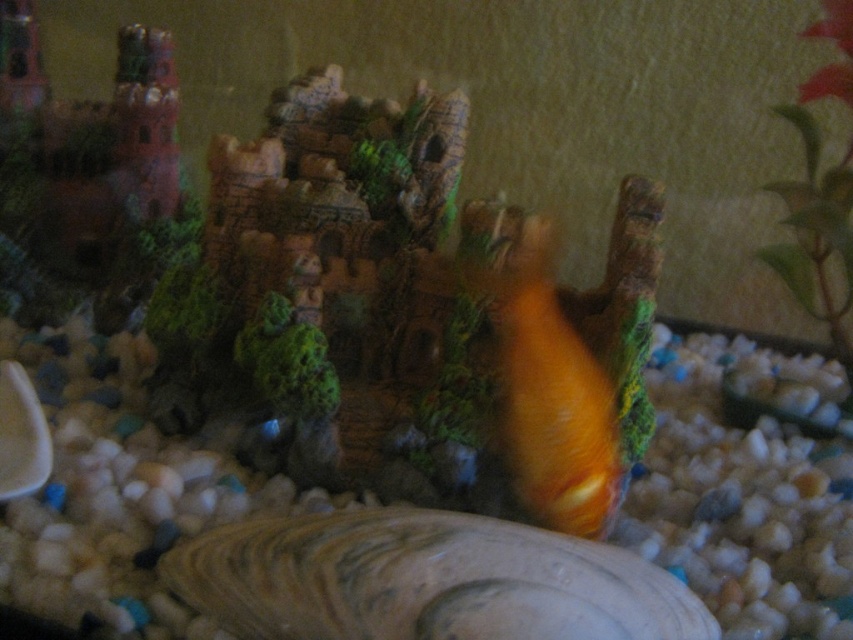
Based on the photo, does orange matte goldfish at center appear under green leafy plant at upper right?

Indeed, orange matte goldfish at center is positioned under green leafy plant at upper right.

Which is more to the left, orange matte goldfish at center or green leafy plant at upper right?

orange matte goldfish at center is more to the left.

Which is behind, point (561, 340) or point (804, 282)?

The point (804, 282) is more distant.

What are the coordinates of `orange matte goldfish at center` in the screenshot? It's located at (553, 397).